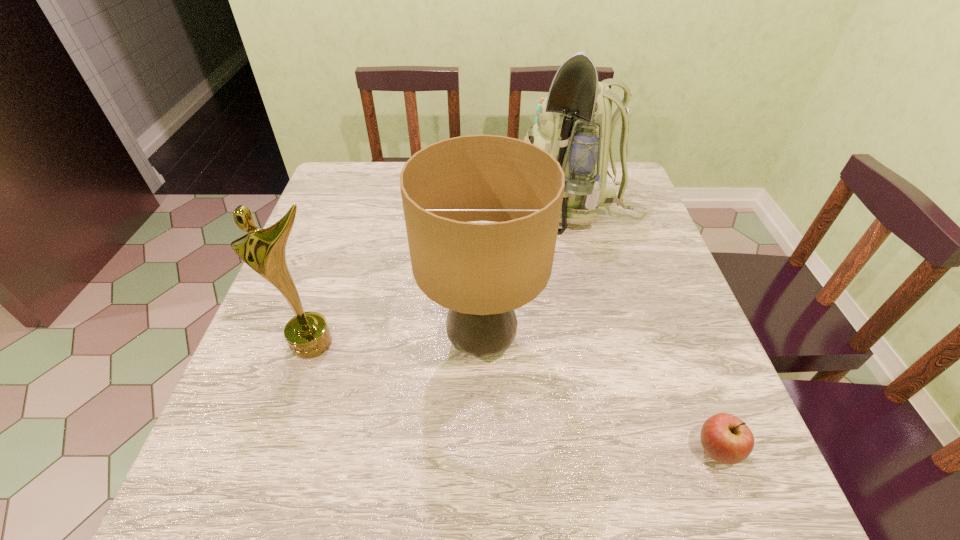
Locate an element on the screen. Image resolution: width=960 pixels, height=540 pixels. vacant space located on the back of the apple is located at coordinates (663, 315).

The image size is (960, 540). I want to click on object that is positioned at the far edge, so click(x=575, y=125).

Find the location of `object situated at the near edge`. object situated at the near edge is located at coordinates (725, 438).

Identify the location of object present at the left edge. The width and height of the screenshot is (960, 540). (307, 334).

The image size is (960, 540). What are the coordinates of `backpack present at the right edge` in the screenshot? It's located at (575, 125).

You are a GUI agent. You are given a task and a screenshot of the screen. Output one action in this format:
    pyautogui.click(x=<x>, y=<y>)
    Task: Click on the apple that is at the right edge
    This screenshot has width=960, height=540.
    Given the screenshot: What is the action you would take?
    pyautogui.click(x=725, y=438)

Locate an element on the screen. This screenshot has width=960, height=540. object located at the far right corner is located at coordinates (575, 125).

Identify the location of object located in the near right corner section of the desktop. The width and height of the screenshot is (960, 540). (725, 438).

In the image, there is a desktop. Where is `free region at the left edge`? The height and width of the screenshot is (540, 960). free region at the left edge is located at coordinates [x=348, y=208].

Find the location of a particular element. This screenshot has height=540, width=960. vacant space at the right edge of the desktop is located at coordinates (611, 226).